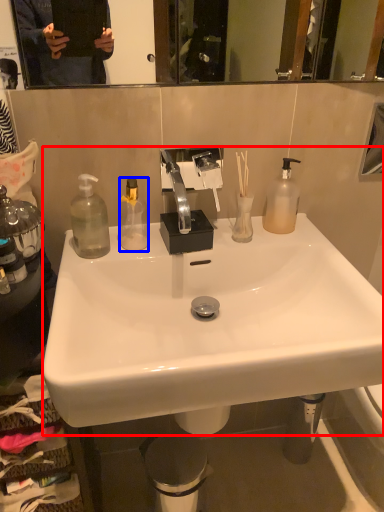
Question: Which of the following is the closest to the observer, sink (highlighted by a red box) or bottle (highlighted by a blue box)?

Choices:
 (A) sink
 (B) bottle

Answer: (A)